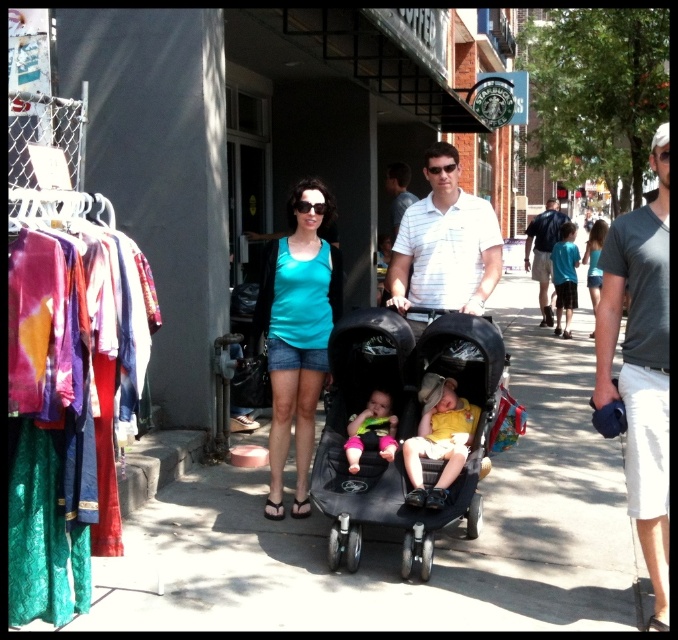
Does smooth concrete pavement at center appear on the right side of matte teal tank top at center?

Correct, you'll find smooth concrete pavement at center to the right of matte teal tank top at center.

Between smooth concrete pavement at center and matte teal tank top at center, which one is positioned lower?

Positioned lower is smooth concrete pavement at center.

Identify the location of smooth concrete pavement at center. (397, 536).

Which of these two, matte teal tank top at center or soft pink fabric baby at center, stands taller?

With more height is matte teal tank top at center.

Does matte teal tank top at center come behind soft pink fabric baby at center?

Yes, matte teal tank top at center is further from the viewer.

Is point (283, 420) positioned behind point (355, 465)?

Yes, point (283, 420) is farther from viewer.

This screenshot has height=640, width=678. What are the coordinates of `matte teal tank top at center` in the screenshot? It's located at (298, 332).

Between point (458, 532) and point (538, 256), which one is positioned in front?

Point (458, 532) is in front.

Does smooth concrete pavement at center come in front of gray cotton t-shirt at center?

Yes, it is in front of gray cotton t-shirt at center.

Identify the location of smooth concrete pavement at center. (x=397, y=536).

Identify the location of smooth concrete pavement at center. This screenshot has width=678, height=640. (397, 536).